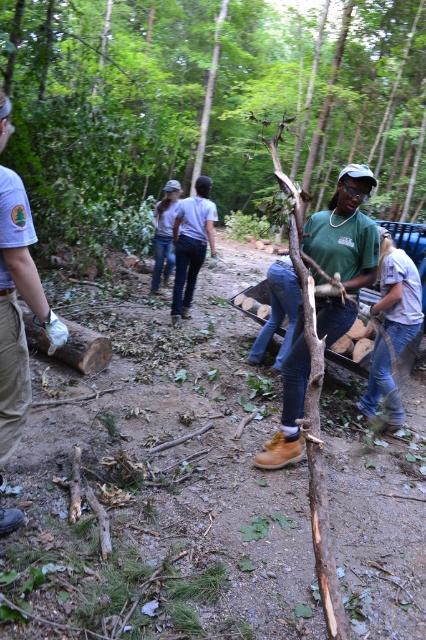
You are a hiker who needs to carry both the brown rough wood at center and the brown leather boots at center. Which item is wider?

The brown rough wood at center is wider than the brown leather boots at center.

You are a hiker who just arrived at the scene. You see the brown rough wood at center and the brushed khaki pants at left. Which object is higher from the ground?

The brown rough wood at center is above the brushed khaki pants at left, so the brown rough wood at center is higher from the ground.